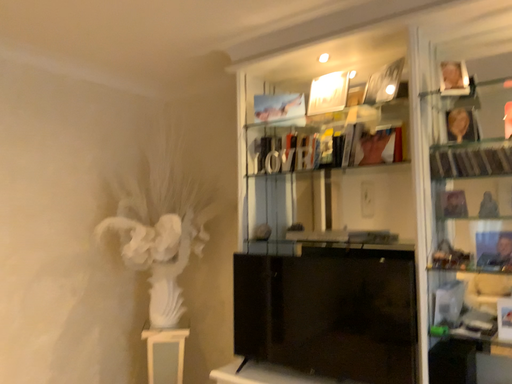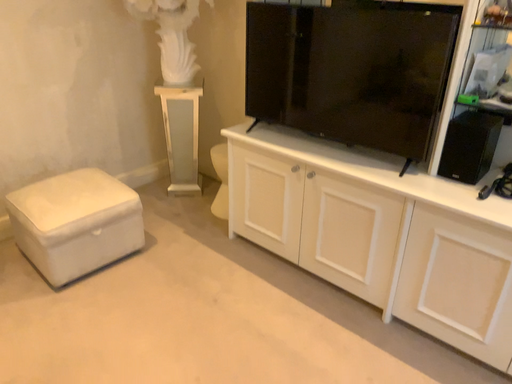
Question: How did the camera likely rotate when shooting the video?

Choices:
 (A) rotated downward
 (B) rotated upward

Answer: (A)